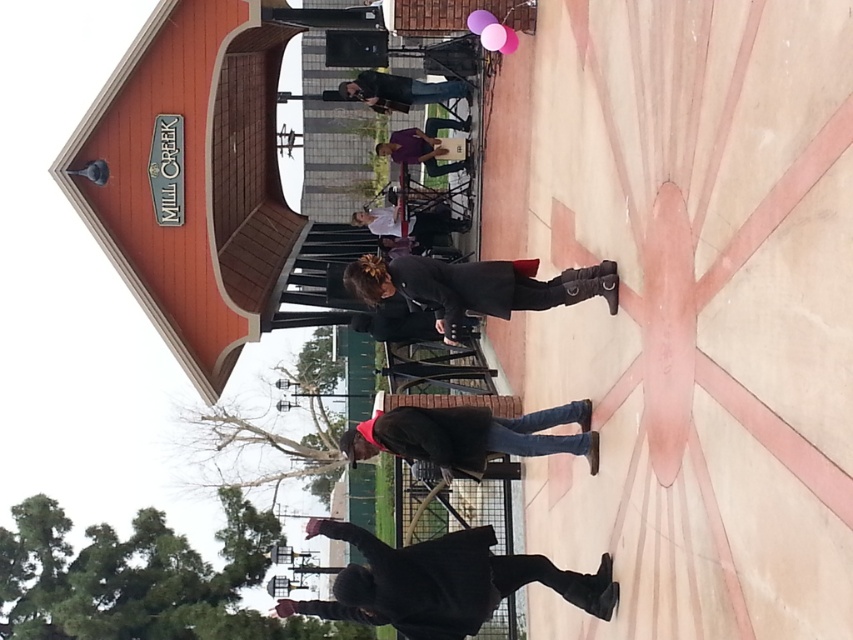
Describe the element at coordinates (440, 582) in the screenshot. I see `black matte skateboard at center` at that location.

The width and height of the screenshot is (853, 640). I want to click on black matte skateboard at center, so click(440, 582).

Is black leather boots at center wider than matte black jacket at center?

Correct, the width of black leather boots at center exceeds that of matte black jacket at center.

Based on the photo, can you confirm if black leather boots at center is thinner than matte black jacket at center?

No, black leather boots at center is not thinner than matte black jacket at center.

What are the coordinates of `black leather boots at center` in the screenshot? It's located at (469, 289).

Can you confirm if black matte skateboard at center is wider than black leather boots at center?

Indeed, black matte skateboard at center has a greater width compared to black leather boots at center.

Can you confirm if black matte skateboard at center is taller than black leather boots at center?

Correct, black matte skateboard at center is much taller as black leather boots at center.

Is point (561, 582) positioned after point (537, 282)?

Yes.

Identify the location of black matte skateboard at center. This screenshot has width=853, height=640. (440, 582).